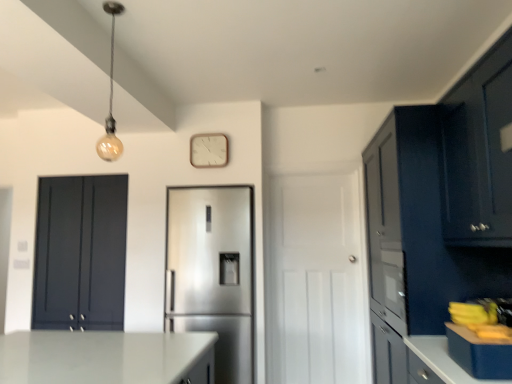
Question: Does matte glass bulb at upper left turn towards wooden clock at upper center?

Choices:
 (A) yes
 (B) no

Answer: (B)

Question: Is matte glass bulb at upper left thinner than wooden clock at upper center?

Choices:
 (A) no
 (B) yes

Answer: (A)

Question: Is matte glass bulb at upper left turned away from wooden clock at upper center?

Choices:
 (A) yes
 (B) no

Answer: (B)

Question: Is wooden clock at upper center inside matte glass bulb at upper left?

Choices:
 (A) yes
 (B) no

Answer: (B)

Question: Is matte glass bulb at upper left shorter than wooden clock at upper center?

Choices:
 (A) yes
 (B) no

Answer: (B)

Question: Considering the positions of point (233, 193) and point (426, 145), is point (233, 193) closer or farther from the camera than point (426, 145)?

Choices:
 (A) closer
 (B) farther

Answer: (B)

Question: Looking at their shapes, would you say satin silver refrigerator at center is wider or thinner than matte dark blue cabinet at right, the 2th cabinetry from the right?

Choices:
 (A) thin
 (B) wide

Answer: (A)

Question: Is satin silver refrigerator at center bigger or smaller than matte dark blue cabinet at right, marked as the second cabinetry in a front-to-back arrangement?

Choices:
 (A) big
 (B) small

Answer: (B)

Question: Is satin silver refrigerator at center in front of or behind matte dark blue cabinet at right, the 2th cabinetry from the right, in the image?

Choices:
 (A) front
 (B) behind

Answer: (B)

Question: In terms of height, does matte dark blue cabinet at right, positioned as the 2th cabinetry in back-to-front order, look taller or shorter compared to white matte door at center?

Choices:
 (A) short
 (B) tall

Answer: (B)

Question: From a real-world perspective, relative to white matte door at center, is matte dark blue cabinet at right, positioned as the 2th cabinetry in back-to-front order, vertically above or below?

Choices:
 (A) above
 (B) below

Answer: (A)

Question: Is point (422, 274) closer or farther from the camera than point (352, 337)?

Choices:
 (A) closer
 (B) farther

Answer: (A)

Question: From the image's perspective, relative to white matte door at center, is matte dark blue cabinet at right, the 2th cabinetry from the right, above or below?

Choices:
 (A) above
 (B) below

Answer: (A)

Question: From a real-world perspective, is matte glass bulb at upper left above or below matte dark blue cabinet at left, placed as the third cabinetry when sorted from front to back?

Choices:
 (A) above
 (B) below

Answer: (A)

Question: From the image's perspective, is matte glass bulb at upper left located above or below matte dark blue cabinet at left, the 1th cabinetry in the left-to-right sequence?

Choices:
 (A) above
 (B) below

Answer: (A)